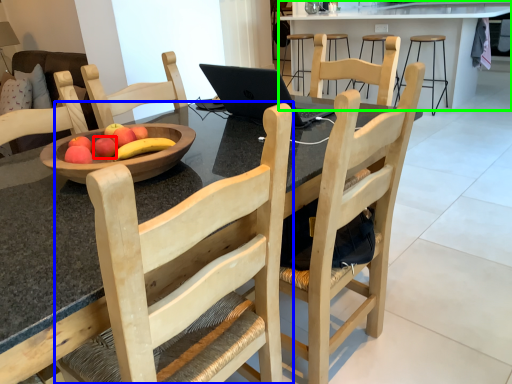
Question: Considering the real-world distances, which object is farthest from apple (highlighted by a red box)? chair (highlighted by a blue box) or table (highlighted by a green box)?

Choices:
 (A) chair
 (B) table

Answer: (B)